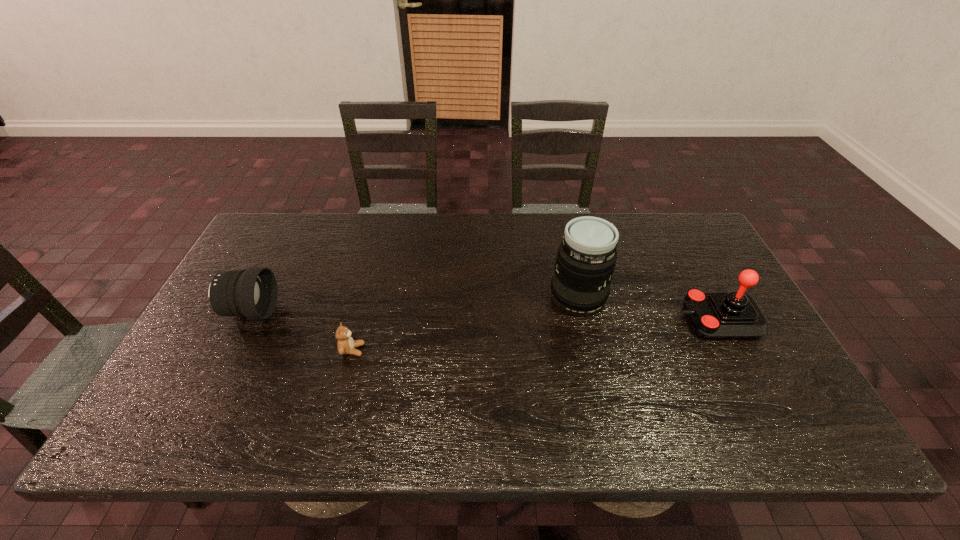
Locate an element on the screen. This screenshot has width=960, height=540. the taller telephoto lens is located at coordinates (x=586, y=258).

At what (x,y) coordinates should I click in order to perform the action: click on the third object from left to right. Please return your answer as a coordinate pair (x, y). This screenshot has width=960, height=540. Looking at the image, I should click on (586, 258).

The image size is (960, 540). I want to click on joystick, so click(x=714, y=315).

The height and width of the screenshot is (540, 960). Identify the location of the third shortest object. (714, 315).

Where is `the third tallest object`? Image resolution: width=960 pixels, height=540 pixels. the third tallest object is located at coordinates (252, 293).

You are a GUI agent. You are given a task and a screenshot of the screen. Output one action in this format:
    pyautogui.click(x=<x>, y=<y>)
    Task: Click on the leftmost object
    The width and height of the screenshot is (960, 540).
    Given the screenshot: What is the action you would take?
    pyautogui.click(x=252, y=293)

This screenshot has height=540, width=960. What are the coordinates of `the shortest object` in the screenshot? It's located at (346, 345).

Identify the location of teddy bear. The height and width of the screenshot is (540, 960). (346, 345).

Locate an element on the screen. vacant space located 0.310m on the front of the taller telephoto lens is located at coordinates (607, 426).

Identify the location of free space located 0.350m on the base of the second tallest object. [x=548, y=320].